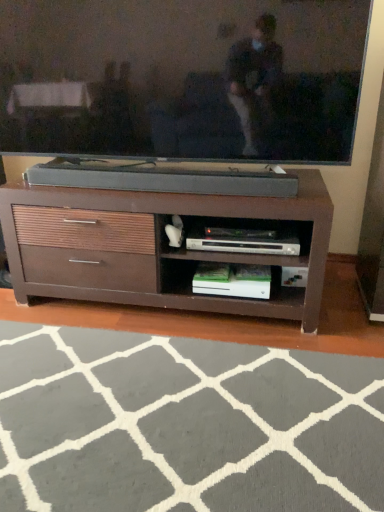
Question: Is matte black tv at upper center bigger than brown wood chest of drawers at center?

Choices:
 (A) no
 (B) yes

Answer: (A)

Question: Does matte black tv at upper center have a greater width compared to brown wood chest of drawers at center?

Choices:
 (A) yes
 (B) no

Answer: (B)

Question: Is matte black tv at upper center further to the viewer compared to brown wood chest of drawers at center?

Choices:
 (A) no
 (B) yes

Answer: (A)

Question: Is brown wood chest of drawers at center at the back of matte black tv at upper center?

Choices:
 (A) yes
 (B) no

Answer: (B)

Question: Is matte black tv at upper center located outside brown wood chest of drawers at center?

Choices:
 (A) yes
 (B) no

Answer: (A)

Question: In the image, is brown wood chest of drawers at center positioned in front of or behind matte black tv at upper center?

Choices:
 (A) behind
 (B) front

Answer: (A)

Question: Considering the positions of brown wood chest of drawers at center and matte black tv at upper center in the image, is brown wood chest of drawers at center wider or thinner than matte black tv at upper center?

Choices:
 (A) wide
 (B) thin

Answer: (A)

Question: From the image's perspective, is brown wood chest of drawers at center located above or below matte black tv at upper center?

Choices:
 (A) below
 (B) above

Answer: (A)

Question: Is brown wood chest of drawers at center spatially inside matte black tv at upper center, or outside of it?

Choices:
 (A) outside
 (B) inside

Answer: (A)

Question: Looking at their shapes, would you say matte black tv at upper center is wider or thinner than gray soft rug at lower center?

Choices:
 (A) thin
 (B) wide

Answer: (A)

Question: Choose the correct answer: Is matte black tv at upper center inside gray soft rug at lower center or outside it?

Choices:
 (A) inside
 (B) outside

Answer: (B)

Question: From a real-world perspective, is matte black tv at upper center physically located above or below gray soft rug at lower center?

Choices:
 (A) above
 (B) below

Answer: (A)

Question: Considering the relative positions of matte black tv at upper center and gray soft rug at lower center in the image provided, is matte black tv at upper center to the left or to the right of gray soft rug at lower center?

Choices:
 (A) left
 (B) right

Answer: (A)

Question: From the image's perspective, is matte black tv at upper center above or below brown wood chest of drawers at center?

Choices:
 (A) below
 (B) above

Answer: (B)

Question: Is matte black tv at upper center wider or thinner than brown wood chest of drawers at center?

Choices:
 (A) thin
 (B) wide

Answer: (A)